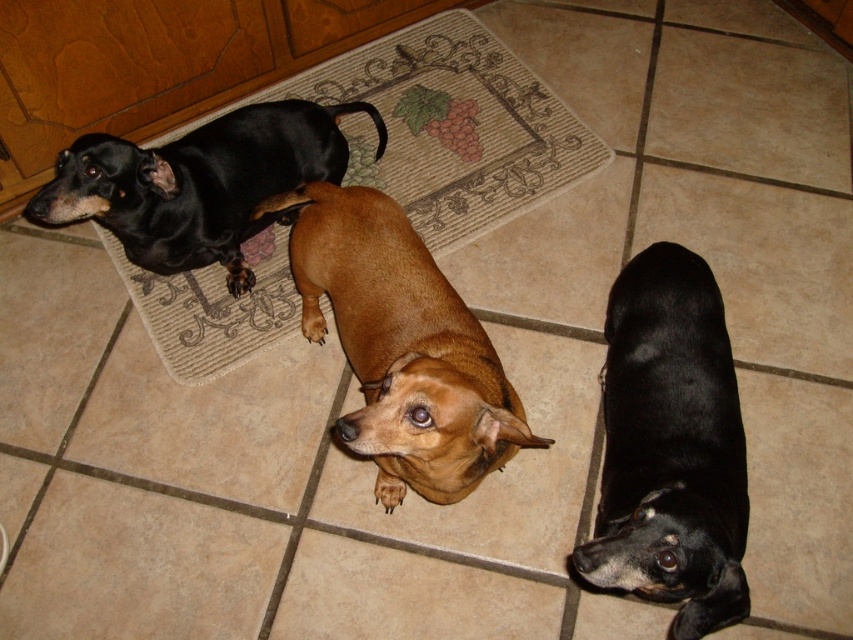
Question: Which object appears closest to the camera in this image?

Choices:
 (A) black matte dog at lower right
 (B) shiny black dog at upper left

Answer: (A)

Question: Which of the following is the farthest from the observer?

Choices:
 (A) shiny black dog at upper left
 (B) black matte dog at lower right
 (C) brown smooth dog at center

Answer: (A)

Question: Is black matte dog at lower right closer to the viewer compared to brown smooth dog at center?

Choices:
 (A) no
 (B) yes

Answer: (A)

Question: Which object is the closest to the black matte dog at lower right?

Choices:
 (A) shiny black dog at upper left
 (B) brown smooth dog at center

Answer: (B)

Question: Is black matte dog at lower right to the left of shiny black dog at upper left from the viewer's perspective?

Choices:
 (A) yes
 (B) no

Answer: (B)

Question: Does brown smooth dog at center have a smaller size compared to shiny black dog at upper left?

Choices:
 (A) yes
 (B) no

Answer: (B)